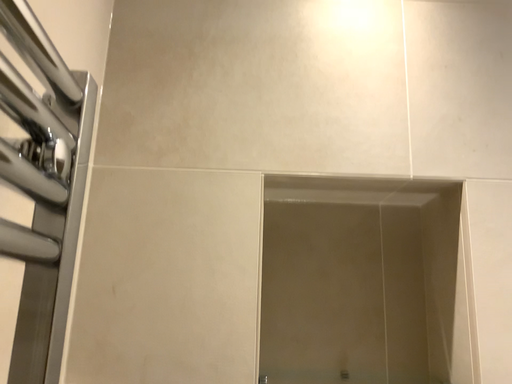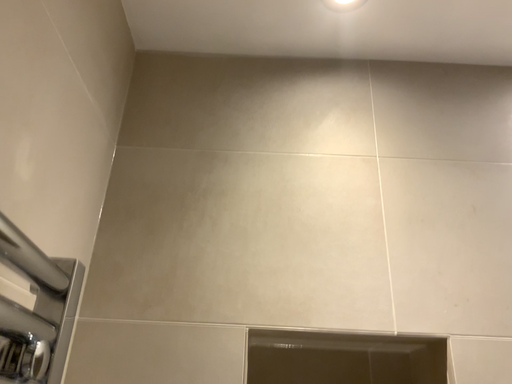
Question: Which way did the camera rotate in the video?

Choices:
 (A) rotated upward
 (B) rotated downward

Answer: (A)